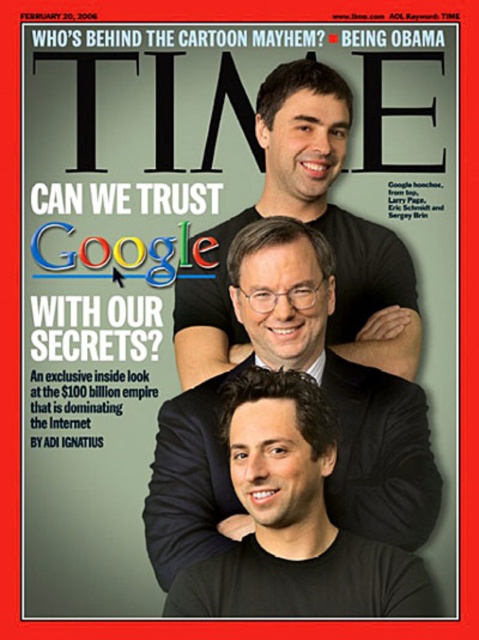
Is matte black suit at center further to camera compared to black matte shirt at center?

No, it is not.

This screenshot has width=479, height=640. What do you see at coordinates (329, 397) in the screenshot?
I see `matte black suit at center` at bounding box center [329, 397].

Where is `matte black suit at center`? matte black suit at center is located at coordinates (329, 397).